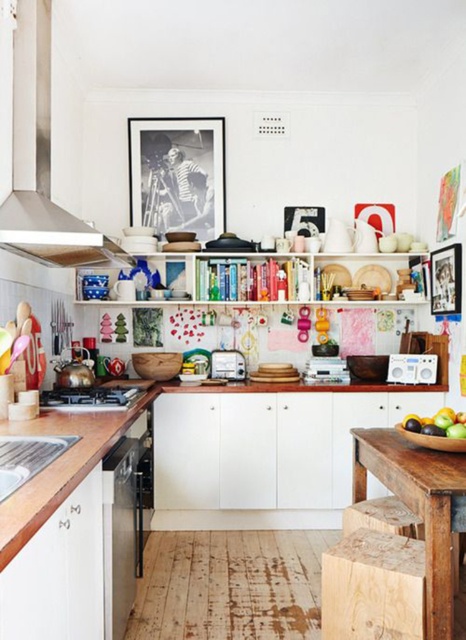
You are standing in the kitchen and need to place a new appliance on the rustic wood table at center. Based on its position, where exactly should you place it?

The rustic wood table at center is located at position coordinates point [418,506], so place the appliance there.

You are a delivery person who needs to place a 6 feet long ladder in the kitchen. You see the black paper picture frame at upper center and the black matte stove at lower left. Can you fit the ladder horizontally between them?

The distance between the black paper picture frame at upper center and the black matte stove at lower left is 5.67 feet. Since the ladder is 6 feet long, it cannot fit horizontally between them as the space is shorter than the ladder.